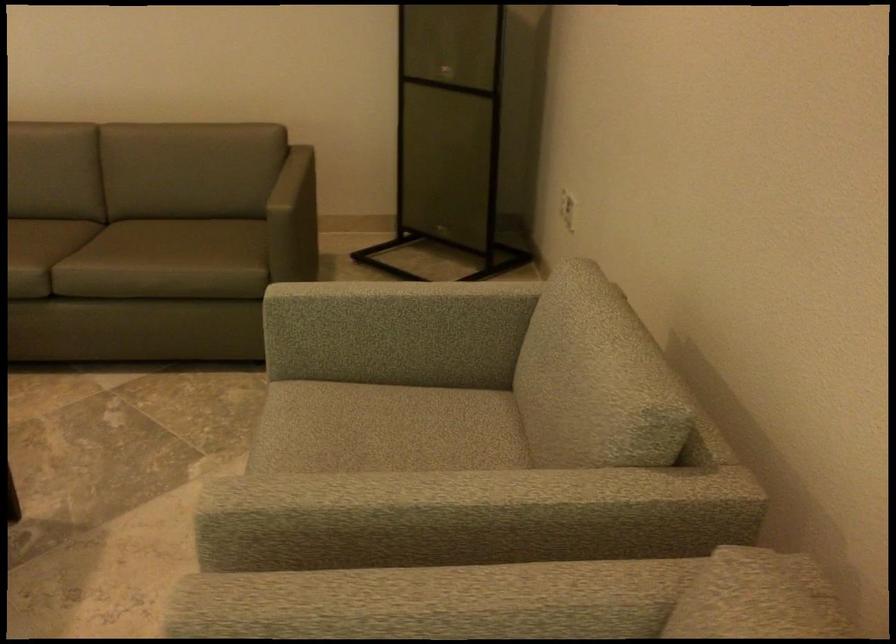
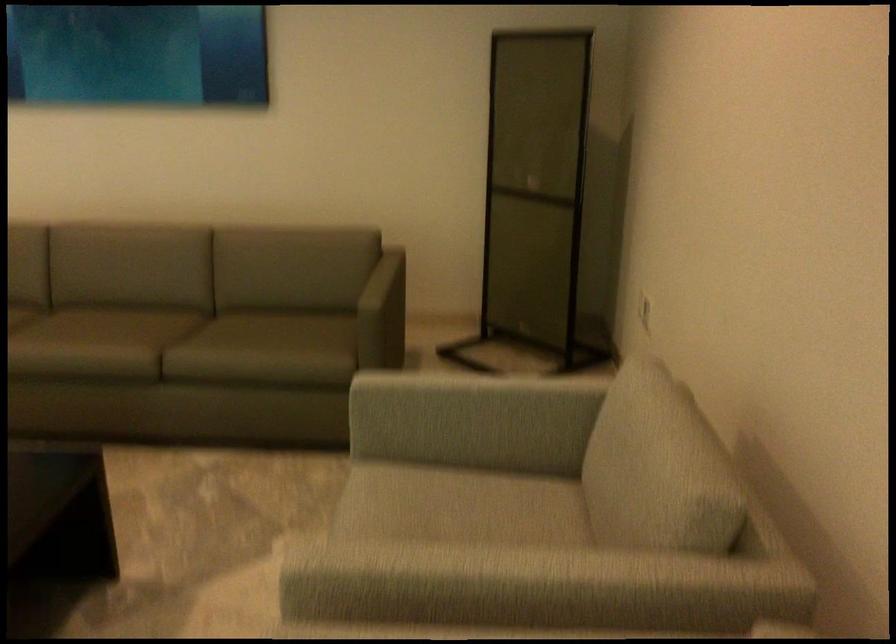
Find the pixel in the second image that matches point 595,362 in the first image.

(653, 451)